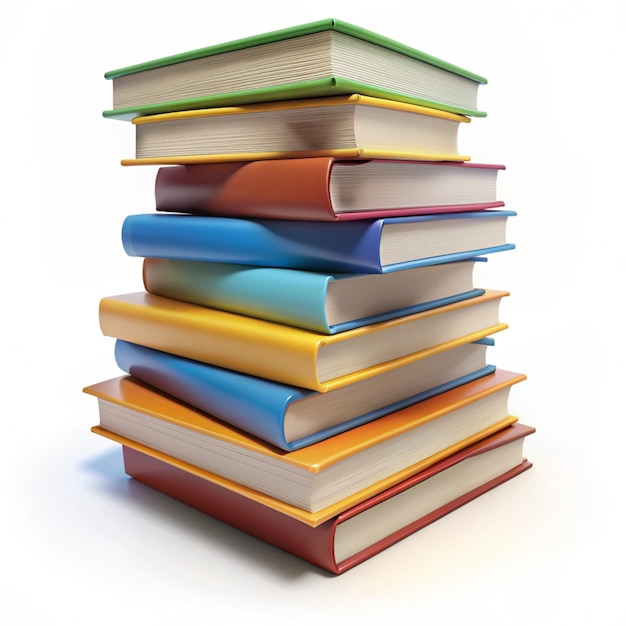
Identify the location of books. Image resolution: width=626 pixels, height=626 pixels. (351, 536), (307, 488), (250, 404), (270, 345), (280, 294), (228, 242), (273, 178), (232, 138), (249, 64).